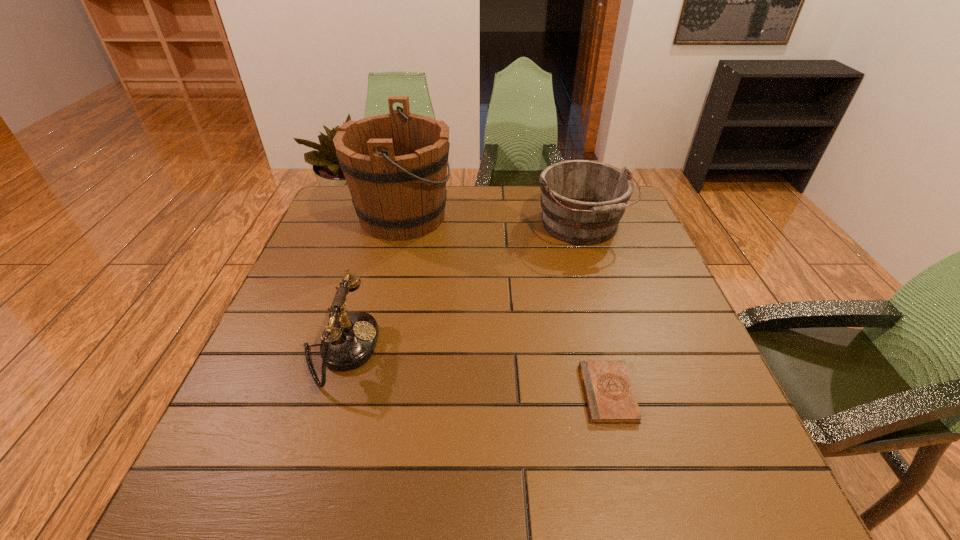
I want to click on free spot between the telephone and the shortest object, so click(x=474, y=371).

Identify which object is the nearest to the telephone. Please provide its 2D coordinates. Your answer should be formatted as a tuple, i.e. [(x, y)], where the tuple contains the x and y coordinates of a point satisfying the conditions above.

[(395, 165)]

Identify the location of object identified as the closest to the telephone. The width and height of the screenshot is (960, 540). (395, 165).

In order to click on free point that satisfies the following two spatial constraints: 1. on the side of the left wine bucket with the handle for carrying; 2. on the left side of the shorter wine bucket in this screenshot , I will do `click(400, 226)`.

Where is `free space that satisfies the following two spatial constraints: 1. on the back side of the shorter wine bucket; 2. on the side of the taller wine bucket with the handle for carrying`? Image resolution: width=960 pixels, height=540 pixels. free space that satisfies the following two spatial constraints: 1. on the back side of the shorter wine bucket; 2. on the side of the taller wine bucket with the handle for carrying is located at coordinates (578, 216).

The width and height of the screenshot is (960, 540). I want to click on free spot that satisfies the following two spatial constraints: 1. on the front side of the right wine bucket; 2. on the dial of the telephone, so click(x=618, y=349).